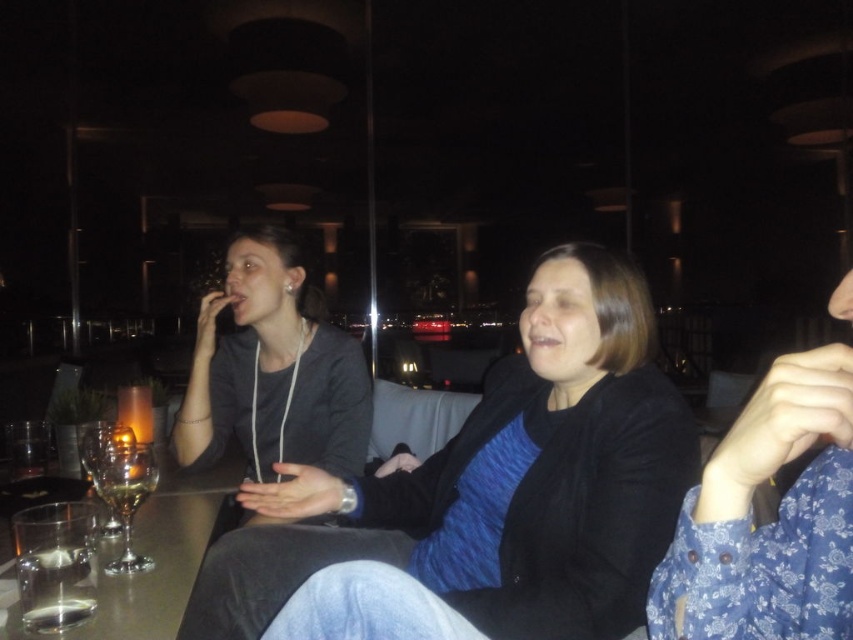
Question: Is matte black jacket at center below clear glass at lower left?

Choices:
 (A) yes
 (B) no

Answer: (B)

Question: Which of the following is the farthest from the observer?

Choices:
 (A) matte black jacket at center
 (B) clear glass wine glass at lower left

Answer: (B)

Question: Is clear glass table at center positioned at the back of clear glass wine glass at lower left?

Choices:
 (A) no
 (B) yes

Answer: (A)

Question: Which point is closer to the camera taking this photo?

Choices:
 (A) (96, 456)
 (B) (83, 611)

Answer: (B)

Question: Observing the image, what is the correct spatial positioning of clear glass at lower left in reference to translucent glass wine glass at lower left?

Choices:
 (A) above
 (B) below

Answer: (B)

Question: Which point is closer to the camera?

Choices:
 (A) (91, 433)
 (B) (135, 563)
 (C) (225, 573)

Answer: (B)